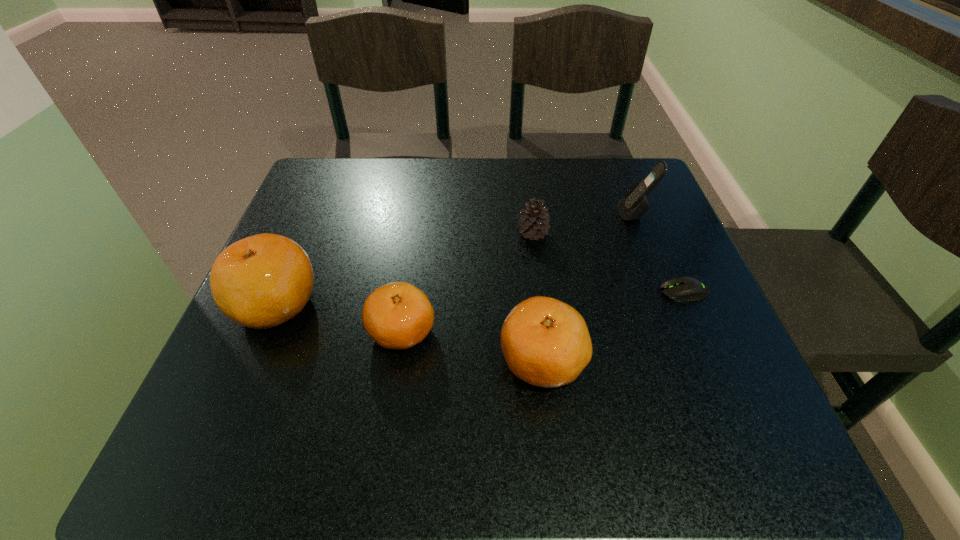
Locate an element on the screen. This screenshot has width=960, height=540. object present at the left edge is located at coordinates (262, 281).

What are the coordinates of `computer mouse situated at the right edge` in the screenshot? It's located at tap(684, 288).

The width and height of the screenshot is (960, 540). In order to click on cellular telephone situated at the right edge in this screenshot , I will do `click(634, 204)`.

This screenshot has width=960, height=540. Find the location of `object present at the far right corner`. object present at the far right corner is located at coordinates (634, 204).

In the image, there is a desktop. Where is `free space at the far edge`? This screenshot has width=960, height=540. free space at the far edge is located at coordinates (559, 161).

Locate an element on the screen. This screenshot has width=960, height=540. vacant region at the near edge is located at coordinates (387, 388).

Find the location of `vacant space at the left edge of the desktop`. vacant space at the left edge of the desktop is located at coordinates (332, 259).

You are a GUI agent. You are given a task and a screenshot of the screen. Output one action in this format:
    pyautogui.click(x=<x>, y=<y>)
    Task: Click on the vacant space at the right edge
    
    Given the screenshot: What is the action you would take?
    pyautogui.click(x=601, y=217)

This screenshot has width=960, height=540. In the image, there is a desktop. What are the coordinates of `blank space at the far left corner` in the screenshot? It's located at (350, 201).

You are a GUI agent. You are given a task and a screenshot of the screen. Output one action in this format:
    pyautogui.click(x=<x>, y=<y>)
    Task: Click on the free space at the near left corner of the desktop
    The width and height of the screenshot is (960, 540).
    Given the screenshot: What is the action you would take?
    pyautogui.click(x=221, y=384)